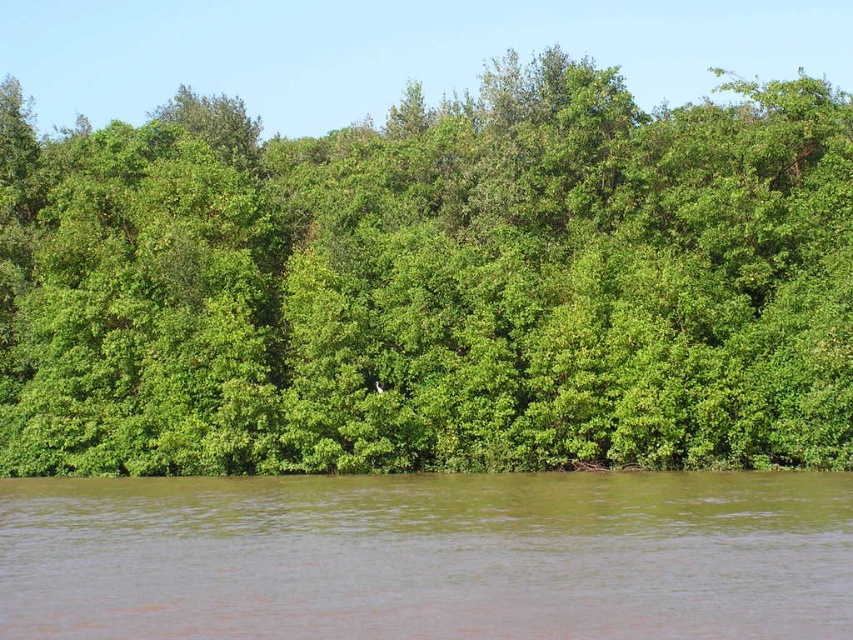
Question: Which point is closer to the camera?

Choices:
 (A) (3, 262)
 (B) (490, 544)

Answer: (B)

Question: Does green leafy trees at center appear under brown murky water at lower center?

Choices:
 (A) no
 (B) yes

Answer: (A)

Question: Which object appears farthest from the camera in this image?

Choices:
 (A) brown murky water at lower center
 (B) green leafy trees at center

Answer: (B)

Question: Does green leafy trees at center appear on the right side of brown murky water at lower center?

Choices:
 (A) yes
 (B) no

Answer: (A)

Question: Is green leafy trees at center positioned at the back of brown murky water at lower center?

Choices:
 (A) yes
 (B) no

Answer: (A)